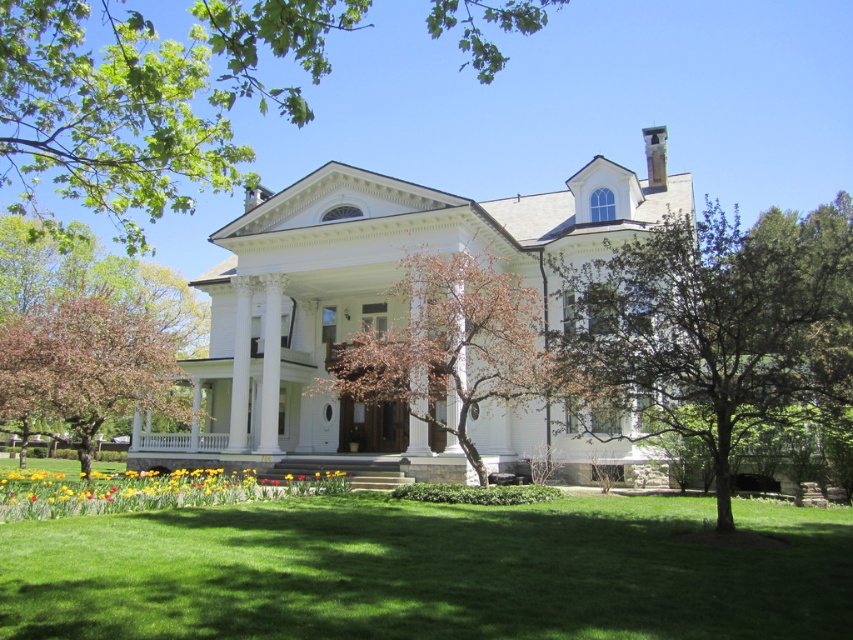
Does green grass at lower center lie in front of yellow matte flowers at lower center?

Yes, green grass at lower center is in front of yellow matte flowers at lower center.

Is green grass at lower center bigger than yellow matte flowers at lower center?

Incorrect, green grass at lower center is not larger than yellow matte flowers at lower center.

The width and height of the screenshot is (853, 640). What do you see at coordinates (431, 570) in the screenshot?
I see `green grass at lower center` at bounding box center [431, 570].

Image resolution: width=853 pixels, height=640 pixels. What are the coordinates of `green grass at lower center` in the screenshot? It's located at (431, 570).

Is the position of green leafy tree at center less distant than that of brown textured tree at center?

Yes, green leafy tree at center is closer to the viewer.

Does point (752, 387) come behind point (548, 380)?

No.

Image resolution: width=853 pixels, height=640 pixels. What are the coordinates of `green leafy tree at center` in the screenshot? It's located at (711, 330).

This screenshot has height=640, width=853. I want to click on green leafy tree at center, so click(x=711, y=330).

Between brown textured tree at center and yellow matte flowers at lower center, which one is positioned lower?

yellow matte flowers at lower center is lower down.

Can you confirm if brown textured tree at center is positioned below yellow matte flowers at lower center?

Actually, brown textured tree at center is above yellow matte flowers at lower center.

Is point (398, 296) positioned before point (229, 493)?

That is False.

Locate an element on the screen. brown textured tree at center is located at coordinates pyautogui.click(x=448, y=346).